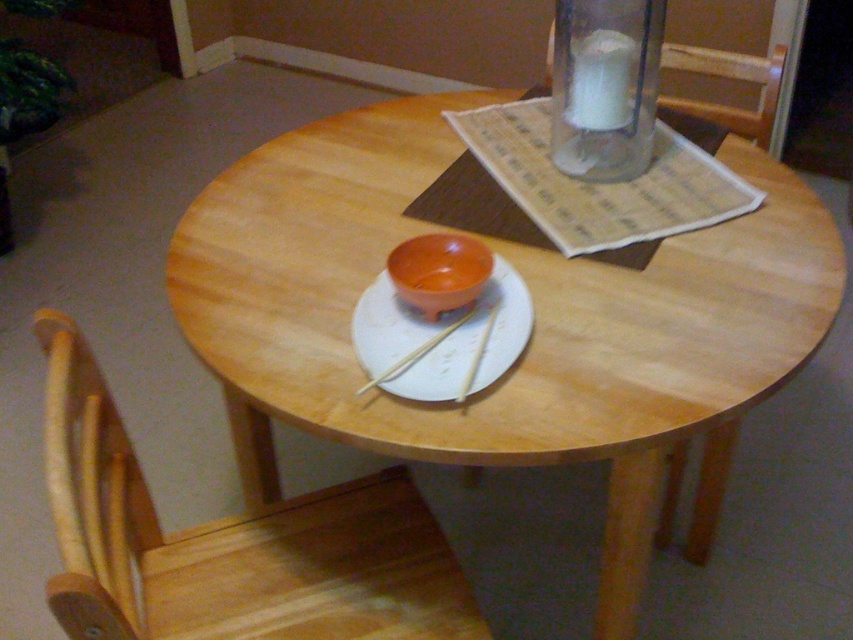
Does white matte plate at center have a lesser height compared to transparent glass candle at upper center?

Yes, white matte plate at center is shorter than transparent glass candle at upper center.

Consider the image. Who is more distant from viewer, (463, 336) or (679, 60)?

Point (679, 60)

Which is behind, point (367, 314) or point (668, 61)?

Point (668, 61)

This screenshot has height=640, width=853. I want to click on white matte plate at center, so click(x=440, y=339).

Can you confirm if wooden round table at center is taller than transparent glass candle at upper center?

Yes, wooden round table at center is taller than transparent glass candle at upper center.

Who is lower down, wooden round table at center or transparent glass candle at upper center?

wooden round table at center

The width and height of the screenshot is (853, 640). In order to click on wooden round table at center in this screenshot , I will do `click(534, 326)`.

Image resolution: width=853 pixels, height=640 pixels. I want to click on wooden round table at center, so click(x=534, y=326).

Is point (457, 413) farther from viewer compared to point (492, 380)?

No, (457, 413) is in front of (492, 380).

Can you confirm if wooden round table at center is thinner than white matte plate at center?

No.

Who is more forward, (285, 241) or (389, 364)?

Positioned in front is point (389, 364).

Where is `wooden round table at center`? wooden round table at center is located at coordinates (534, 326).